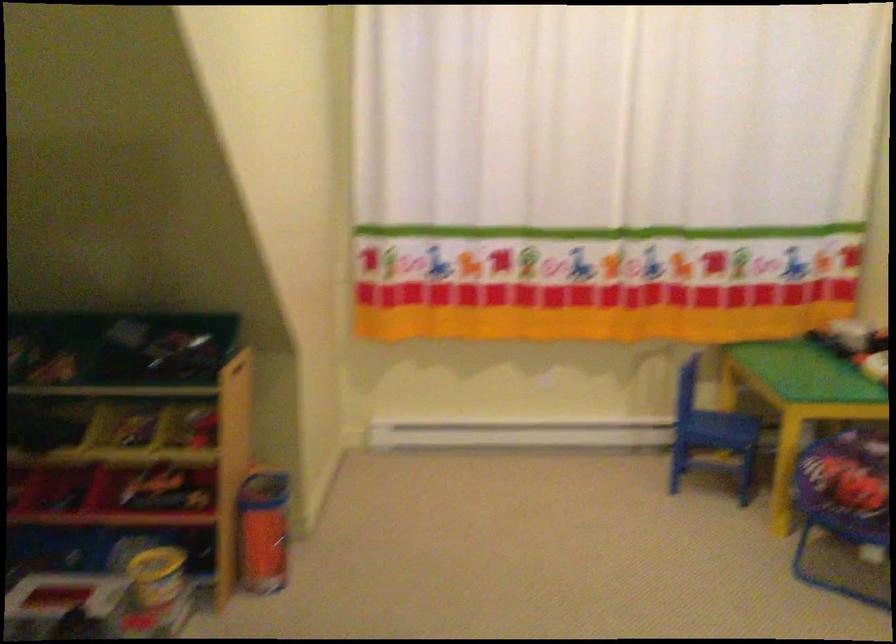
In order to click on blue chair sitting surface in this screenshot , I will do `click(718, 430)`.